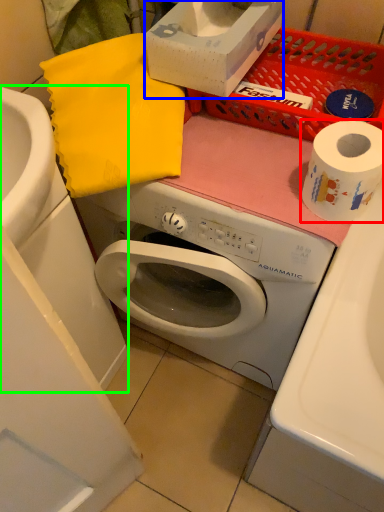
Question: Which object is positioned farthest from toilet paper (highlighted by a red box)? Select from box (highlighted by a blue box) and sink (highlighted by a green box).

Choices:
 (A) box
 (B) sink

Answer: (B)